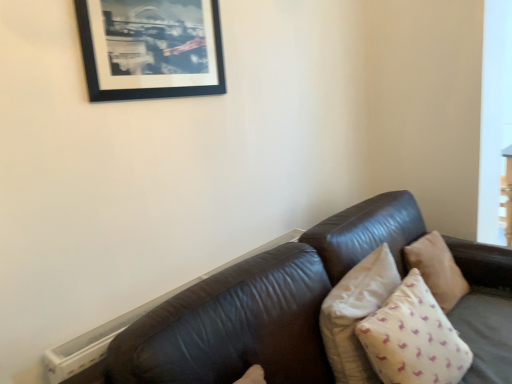
Question: In terms of height, does beige cotton pillow at lower right, which is the third pillow from back to front, look taller or shorter compared to beige fabric pillow at right, which is the 3th pillow in front-to-back order?

Choices:
 (A) short
 (B) tall

Answer: (B)

Question: In terms of size, does beige cotton pillow at lower right, the first pillow viewed from the front, appear bigger or smaller than beige fabric pillow at right, which is counted as the 1th pillow, starting from the back?

Choices:
 (A) small
 (B) big

Answer: (B)

Question: Which is nearer to the beige fabric pillow at right, arranged as the 2th pillow when viewed from the back?

Choices:
 (A) black matte picture frame at upper left
 (B) beige cotton pillow at lower right, the first pillow viewed from the front
 (C) beige fabric pillow at right, which is counted as the 1th pillow, starting from the back

Answer: (B)

Question: Which object is positioned closest to the beige fabric pillow at right, the 2th pillow from the front?

Choices:
 (A) beige cotton pillow at lower right, which is the third pillow from back to front
 (B) black matte picture frame at upper left
 (C) beige fabric pillow at right, which is counted as the 1th pillow, starting from the back

Answer: (A)